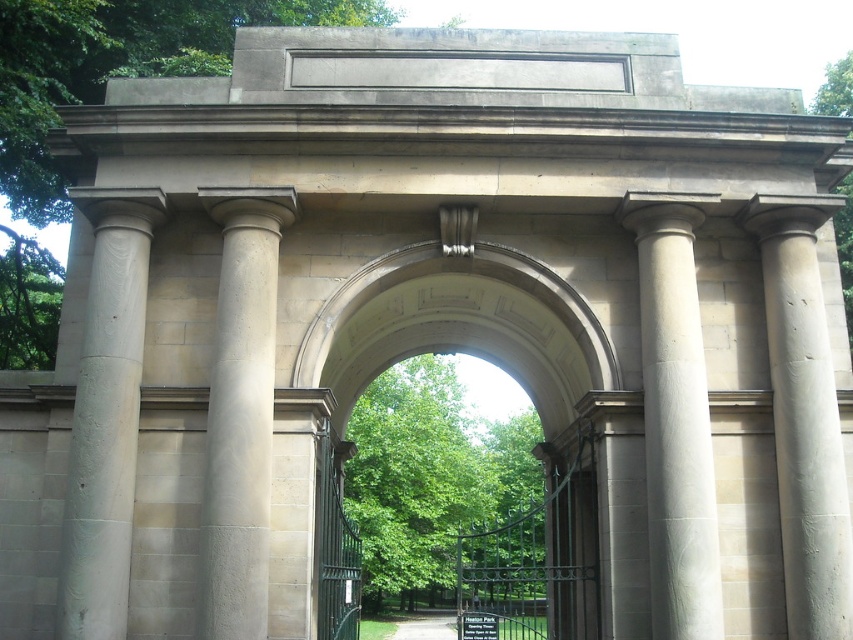
You are standing in front of the grand stone archway and want to enter through the green wrought iron gate at center. Which direction should you move to avoid the smooth stone column at right blocking your path?

To avoid the smooth stone column at right, which is above the green wrought iron gate at center, you should move to the left side of the gate since the column is positioned above it on the right.

You are standing in front of the grand stone archway and want to walk through the green wrought iron gate at center. Which direction should you move relative to the smooth stone column at right to reach the gate?

To reach the green wrought iron gate at center, you should move towards the left of the smooth stone column at right since the column is blocking the direct path to the gate.